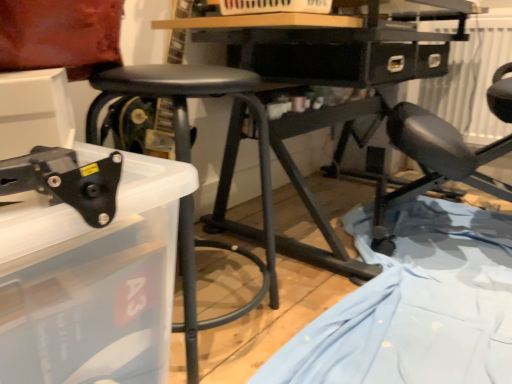
This screenshot has width=512, height=384. What do you see at coordinates (66, 181) in the screenshot? I see `black plastic tool at lower left` at bounding box center [66, 181].

Describe the element at coordinates (190, 162) in the screenshot. I see `black matte stool at center` at that location.

The height and width of the screenshot is (384, 512). Describe the element at coordinates (415, 306) in the screenshot. I see `light blue fabric at lower right` at that location.

Find the location of a particular element. This screenshot has height=384, width=512. matte black chair at right is located at coordinates (434, 163).

This screenshot has width=512, height=384. What are the coordinates of `black plastic tool at lower left` in the screenshot? It's located at (66, 181).

Which is more to the right, black plastic tool at lower left or light blue fabric at lower right?

From the viewer's perspective, light blue fabric at lower right appears more on the right side.

Considering the relative sizes of black plastic tool at lower left and light blue fabric at lower right in the image provided, is black plastic tool at lower left smaller than light blue fabric at lower right?

Correct, black plastic tool at lower left occupies less space than light blue fabric at lower right.

Is black plastic tool at lower left next to light blue fabric at lower right?

black plastic tool at lower left and light blue fabric at lower right are not in contact.

Is light blue fabric at lower right inside black plastic tool at lower left?

No.

Based on the photo, is light blue fabric at lower right positioned far away from matte black chair at right?

Actually, light blue fabric at lower right and matte black chair at right are a little close together.

Considering the sizes of objects light blue fabric at lower right and matte black chair at right in the image provided, who is wider, light blue fabric at lower right or matte black chair at right?

light blue fabric at lower right.

From a real-world perspective, between light blue fabric at lower right and matte black chair at right, who is vertically higher?

From a 3D spatial view, matte black chair at right is above.

Considering the positions of points (371, 363) and (510, 145), is point (371, 363) closer to camera compared to point (510, 145)?

That is True.

Considering the relative sizes of matte black chair at right and black plastic tool at lower left in the image provided, is matte black chair at right wider than black plastic tool at lower left?

Yes.

Would you say matte black chair at right is a long distance from black plastic tool at lower left?

That's right, there is a large distance between matte black chair at right and black plastic tool at lower left.

Is point (376, 222) closer to viewer compared to point (115, 192)?

No, it is not.

Which of these two, matte black chair at right or black plastic tool at lower left, is bigger?

matte black chair at right.

Is black matte stool at center oriented away from matte black chair at right?

No, black matte stool at center's orientation is not away from matte black chair at right.

Which object is more forward, black matte stool at center or matte black chair at right?

black matte stool at center.

From a real-world perspective, is black matte stool at center physically above matte black chair at right?

No, from a real-world perspective, black matte stool at center is not over matte black chair at right

Is black matte stool at center to the left of black plastic tool at lower left from the viewer's perspective?

No, black matte stool at center is not to the left of black plastic tool at lower left.

Looking at this image, what's the angular difference between black matte stool at center and black plastic tool at lower left's facing directions?

The angle between the facing direction of black matte stool at center and the facing direction of black plastic tool at lower left is 96.2 degrees.

Is point (242, 96) in front of point (81, 184)?

No, it is not.

Considering the relative sizes of matte black chair at right and light blue fabric at lower right in the image provided, is matte black chair at right shorter than light blue fabric at lower right?

Incorrect, the height of matte black chair at right does not fall short of that of light blue fabric at lower right.

Is matte black chair at right turned away from light blue fabric at lower right?

matte black chair at right does not have its back to light blue fabric at lower right.

What's the angular difference between matte black chair at right and light blue fabric at lower right's facing directions?

The angular difference between matte black chair at right and light blue fabric at lower right is 167 degrees.

Can you confirm if matte black chair at right is thinner than light blue fabric at lower right?

Correct, the width of matte black chair at right is less than that of light blue fabric at lower right.

Visually, is light blue fabric at lower right positioned to the left or to the right of black plastic tool at lower left?

In the image, light blue fabric at lower right appears on the right side of black plastic tool at lower left.

Which of these two, light blue fabric at lower right or black plastic tool at lower left, is bigger?

light blue fabric at lower right is bigger.

Between point (336, 362) and point (55, 203), which one is positioned behind?

The point (336, 362) is farther from the camera.

Where is `sheet below the black plastic tool at lower left (from a real-world perspective)`? The image size is (512, 384). sheet below the black plastic tool at lower left (from a real-world perspective) is located at coordinates (415, 306).

Find the location of `sheet that is under the black plastic tool at lower left (from a real-world perspective)`. sheet that is under the black plastic tool at lower left (from a real-world perspective) is located at coordinates (415, 306).

In the image, there is a light blue fabric at lower right. In order to click on chair above it (from the image's perspective) in this screenshot , I will do `click(434, 163)`.

Looking at the image, which one is located closer to light blue fabric at lower right, black matte stool at center or black plastic tool at lower left?

black matte stool at center lies closer to light blue fabric at lower right than the other object.

Which object lies further to the anchor point light blue fabric at lower right, matte black chair at right or black matte stool at center?

black matte stool at center lies further to light blue fabric at lower right than the other object.

Estimate the real-world distances between objects in this image. Which object is further from black matte stool at center, light blue fabric at lower right or matte black chair at right?

matte black chair at right is further to black matte stool at center.

Estimate the real-world distances between objects in this image. Which object is further from black plastic tool at lower left, black matte stool at center or matte black chair at right?

Among the two, matte black chair at right is located further to black plastic tool at lower left.

Based on their spatial positions, is matte black chair at right or light blue fabric at lower right further from black matte stool at center?

The object further to black matte stool at center is matte black chair at right.

Based on their spatial positions, is black matte stool at center or light blue fabric at lower right further from matte black chair at right?

Among the two, black matte stool at center is located further to matte black chair at right.

Looking at the image, which one is located closer to black plastic tool at lower left, black matte stool at center or light blue fabric at lower right?

Among the two, black matte stool at center is located nearer to black plastic tool at lower left.

Looking at this image, looking at the image, which one is located further to black plastic tool at lower left, light blue fabric at lower right or matte black chair at right?

matte black chair at right lies further to black plastic tool at lower left than the other object.

You are a GUI agent. You are given a task and a screenshot of the screen. Output one action in this format:
    pyautogui.click(x=<x>, y=<y>)
    Task: Click on the sheet between black plastic tool at lower left and matte black chair at right in the horizontal direction
    The image size is (512, 384).
    Given the screenshot: What is the action you would take?
    pyautogui.click(x=415, y=306)

Locate an element on the screen. stool located between black plastic tool at lower left and light blue fabric at lower right in the left-right direction is located at coordinates point(190,162).

Locate an element on the screen. Image resolution: width=512 pixels, height=384 pixels. sheet situated between black matte stool at center and matte black chair at right from left to right is located at coordinates (415, 306).

The image size is (512, 384). Identify the location of stool situated between black plastic tool at lower left and matte black chair at right from left to right. (190, 162).